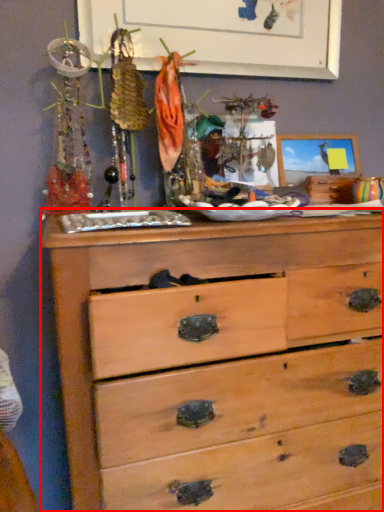
Question: Observing the image, what is the correct spatial positioning of chest of drawers (annotated by the red box) in reference to bulletin board?

Choices:
 (A) right
 (B) left

Answer: (A)